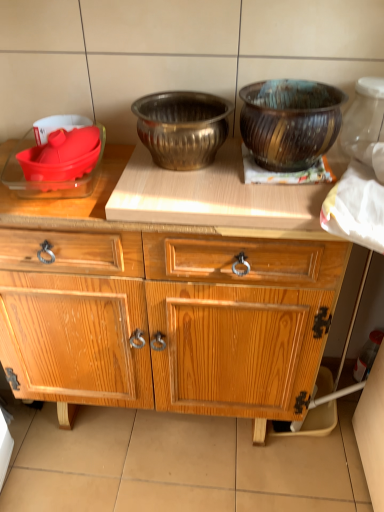
You are a GUI agent. You are given a task and a screenshot of the screen. Output one action in this format:
    pyautogui.click(x=<x>, y=<y>)
    Task: Click on the vacant region to the left of brushed metal bowl at center, the 3th bowl viewed from the left
    The height and width of the screenshot is (512, 384).
    Given the screenshot: What is the action you would take?
    pyautogui.click(x=104, y=169)